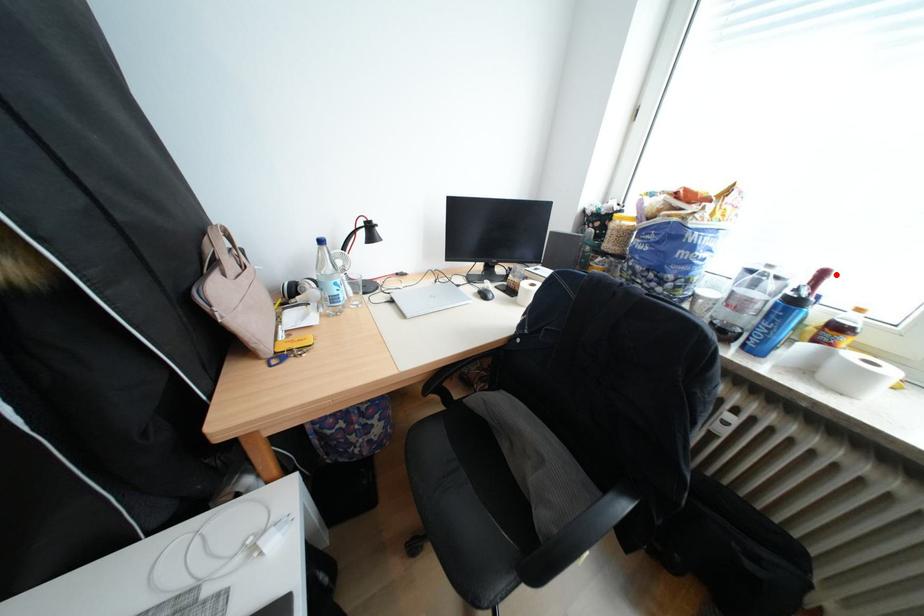
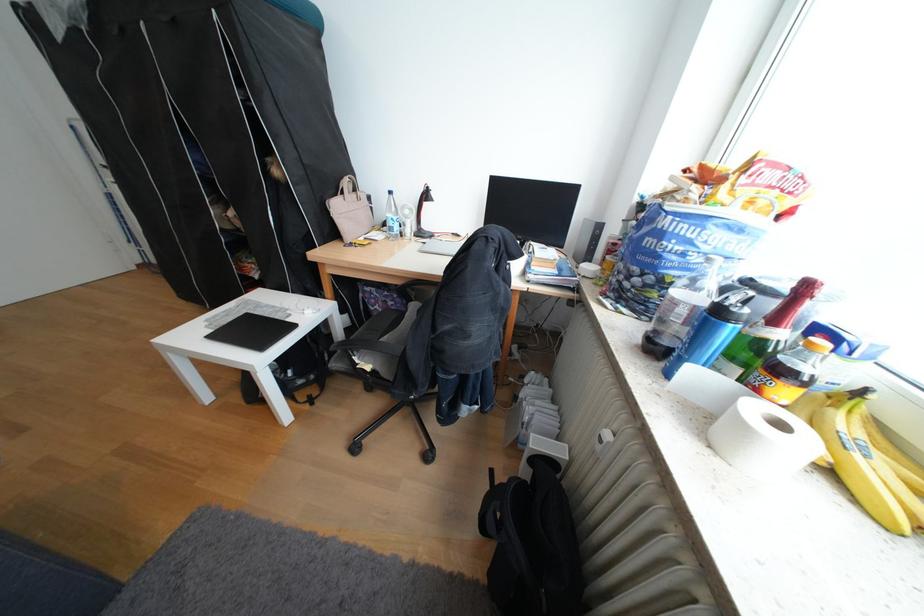
Where in the second image is the point corresponding to the highlighted location from the first image?

(819, 288)